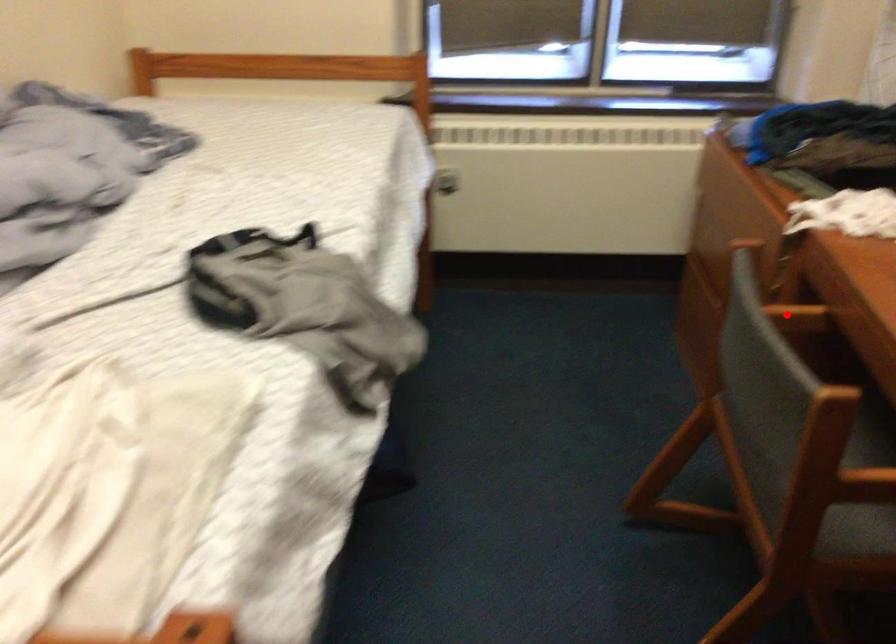
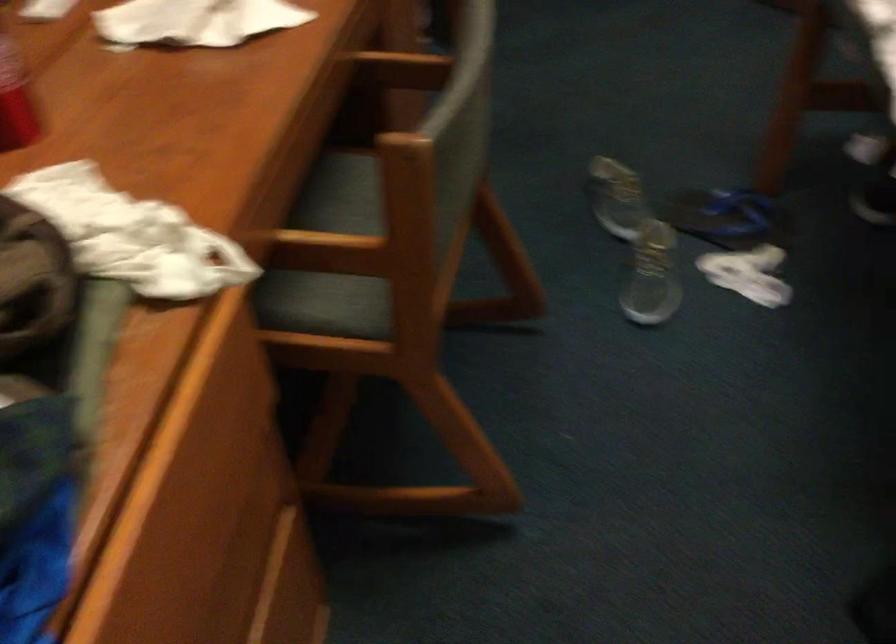
Locate, in the second image, the point that corresponds to the highlighted location in the first image.

(339, 250)